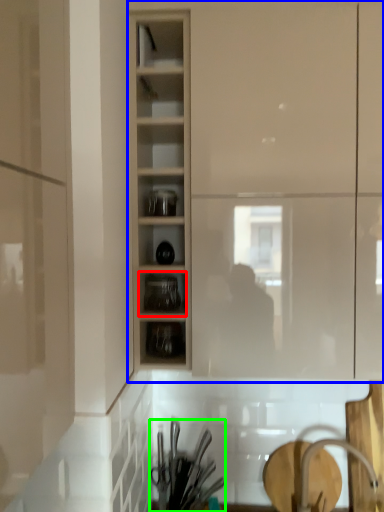
Question: Considering the real-world distances, which object is farthest from shelf (highlighted by a red box)? cupboard (highlighted by a blue box) or tableware (highlighted by a green box)?

Choices:
 (A) cupboard
 (B) tableware

Answer: (B)